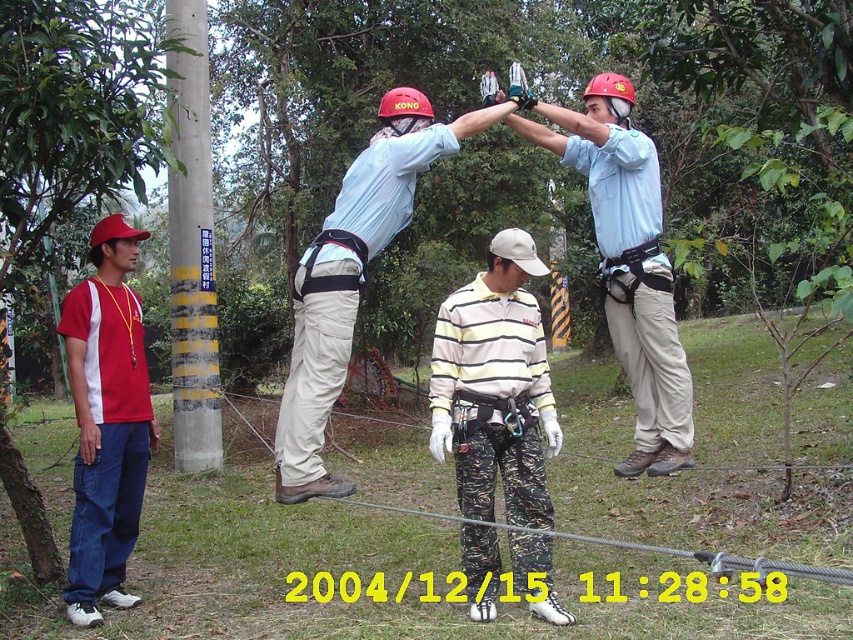
You are standing in the park and see the light blue fabric shirt at center and the concrete pole at left. Which object is closer to the ground?

The light blue fabric shirt at center is closer to the ground because it is located below the concrete pole at left.

You are standing in the park and see the light blue shirt at center and the metallic wire at center. Which object is closer to you?

The light blue shirt at center is closer to you because it is further to the viewer than the metallic wire at center.